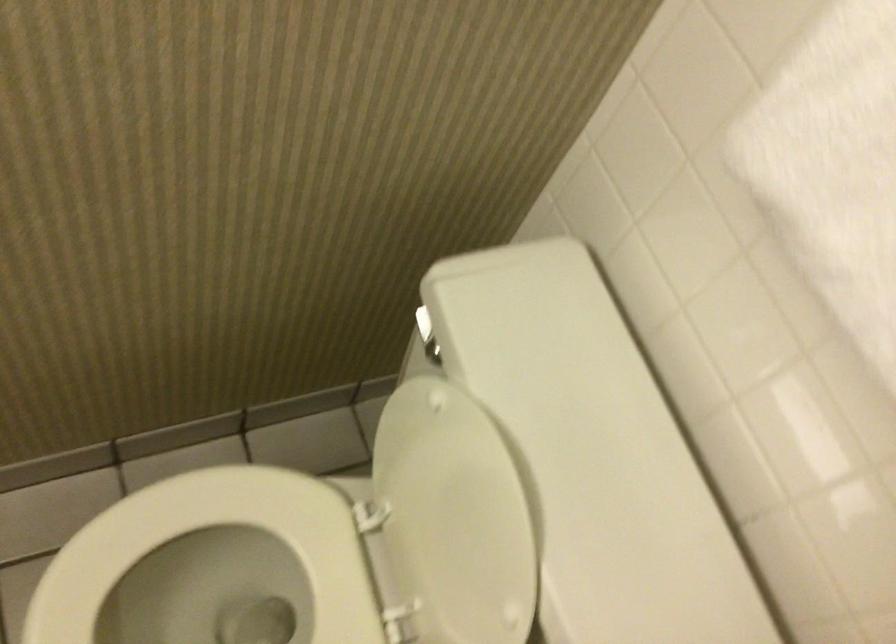
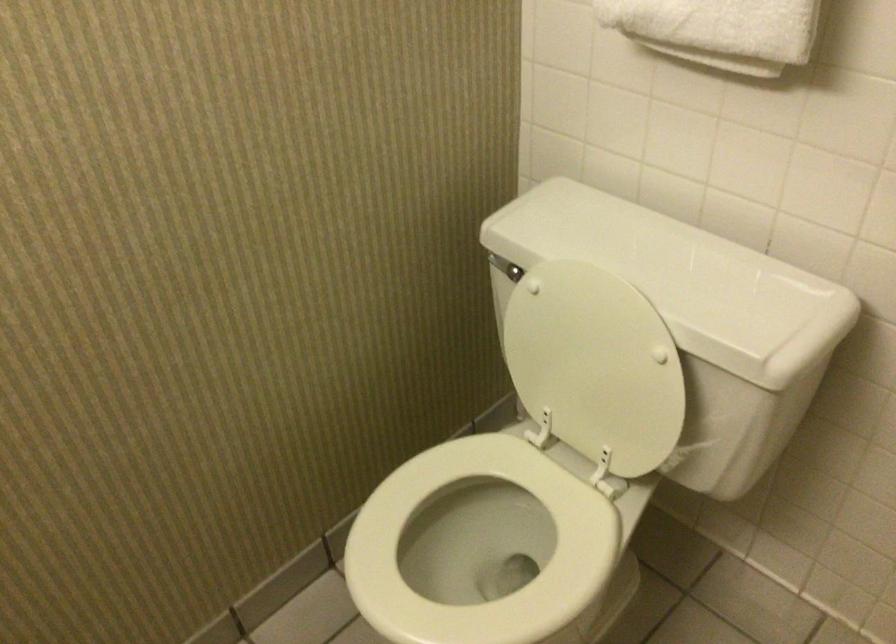
Question: Based on the continuous images, in which direction is the camera rotating? Reply with the corresponding letter.

Choices:
 (A) Left
 (B) Right
 (C) Up
 (D) Down

Answer: (C)